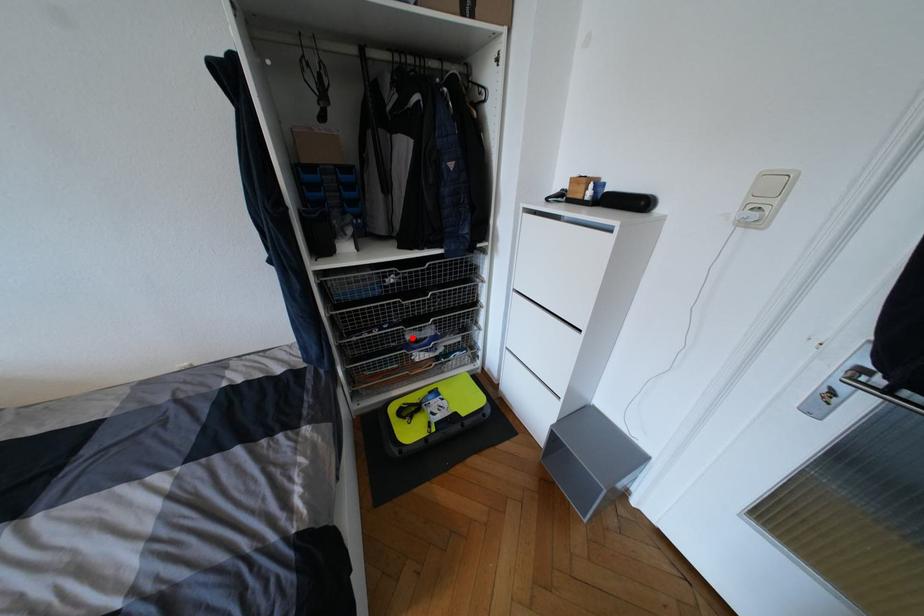
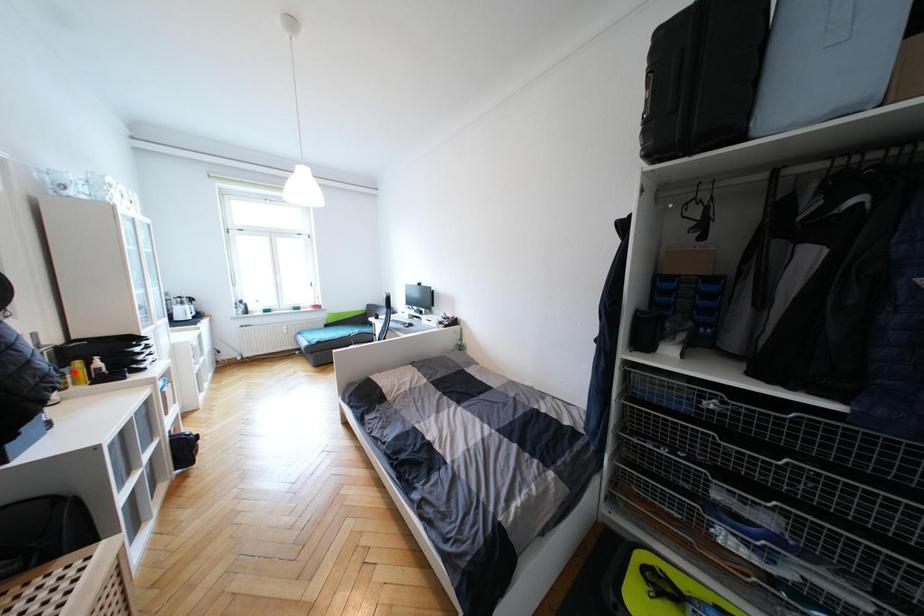
I am providing you with two images of the same scene from different viewpoints. A red point is marked on the first image and another point is marked on the second image. Is the red point in image1 aligned with the point shown in image2?

No